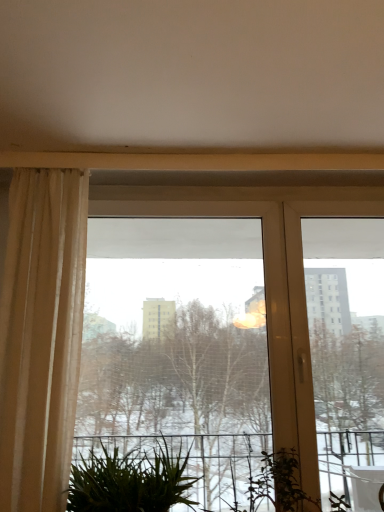
Question: Should I look upward or downward to see green leafy plant at lower center?

Choices:
 (A) up
 (B) down

Answer: (B)

Question: Does transparent glass window at center have a greater width compared to green leafy plant at lower center?

Choices:
 (A) yes
 (B) no

Answer: (B)

Question: Is transparent glass window at center oriented towards green leafy plant at lower center?

Choices:
 (A) yes
 (B) no

Answer: (A)

Question: Does transparent glass window at center appear on the left side of green leafy plant at lower center?

Choices:
 (A) yes
 (B) no

Answer: (B)

Question: Is transparent glass window at center to the right of green leafy plant at lower center from the viewer's perspective?

Choices:
 (A) no
 (B) yes

Answer: (B)

Question: From the image's perspective, is transparent glass window at center below green leafy plant at lower center?

Choices:
 (A) no
 (B) yes

Answer: (A)

Question: Considering the relative sizes of transparent glass window at center and green leafy plant at lower center in the image provided, is transparent glass window at center smaller than green leafy plant at lower center?

Choices:
 (A) no
 (B) yes

Answer: (A)

Question: Is green leafy plant at lower center facing towards beige sheer curtain at left?

Choices:
 (A) yes
 (B) no

Answer: (B)

Question: From the image's perspective, is green leafy plant at lower center over beige sheer curtain at left?

Choices:
 (A) yes
 (B) no

Answer: (B)

Question: Is green leafy plant at lower center positioned before beige sheer curtain at left?

Choices:
 (A) yes
 (B) no

Answer: (B)

Question: Is green leafy plant at lower center not within beige sheer curtain at left?

Choices:
 (A) yes
 (B) no

Answer: (A)

Question: Is green leafy plant at lower center looking in the opposite direction of beige sheer curtain at left?

Choices:
 (A) yes
 (B) no

Answer: (B)

Question: Considering the relative positions of green leafy plant at lower center and beige sheer curtain at left in the image provided, is green leafy plant at lower center to the left of beige sheer curtain at left from the viewer's perspective?

Choices:
 (A) yes
 (B) no

Answer: (B)

Question: Is green leafy plant at lower center thinner than transparent glass window at center?

Choices:
 (A) yes
 (B) no

Answer: (B)